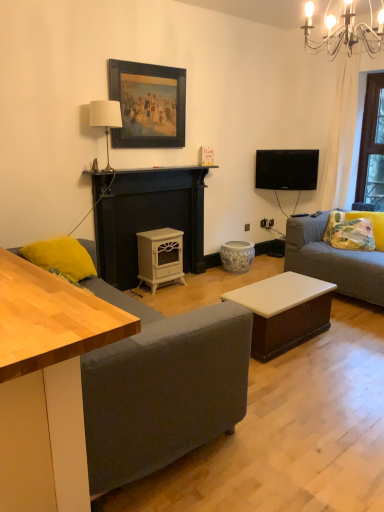
Where is `vacant area that lies in front of white glossy coffee table at center`? The height and width of the screenshot is (512, 384). vacant area that lies in front of white glossy coffee table at center is located at coordinates (315, 379).